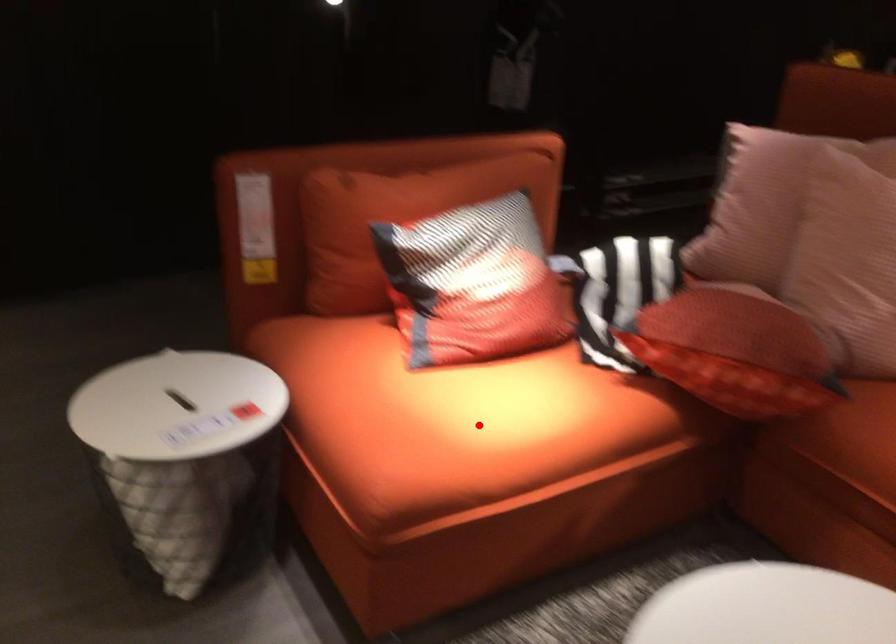
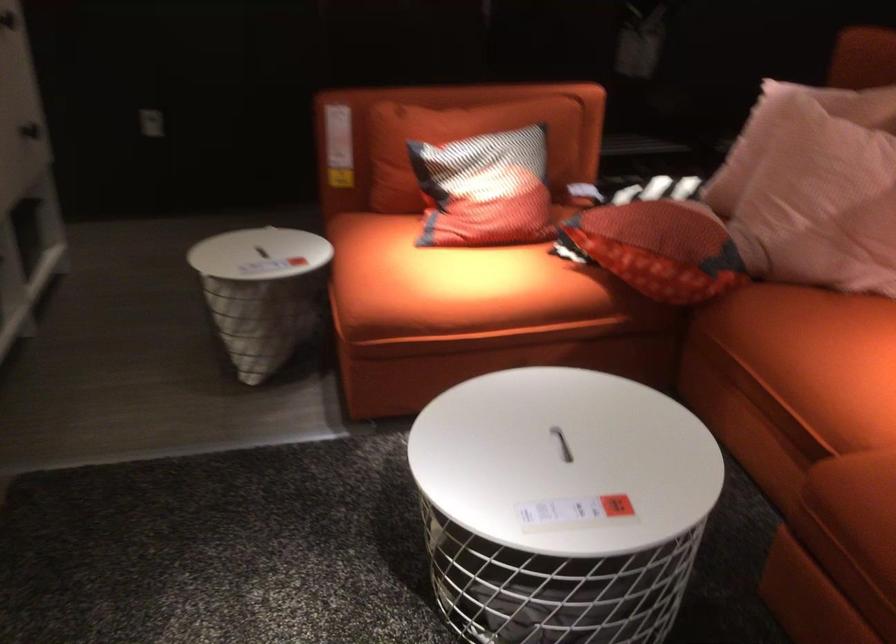
Question: I am providing you with two images of the same scene from different viewpoints. A red point is marked on the first image. Can you still see the location of the red point in image 2?

Choices:
 (A) Yes
 (B) No

Answer: (A)